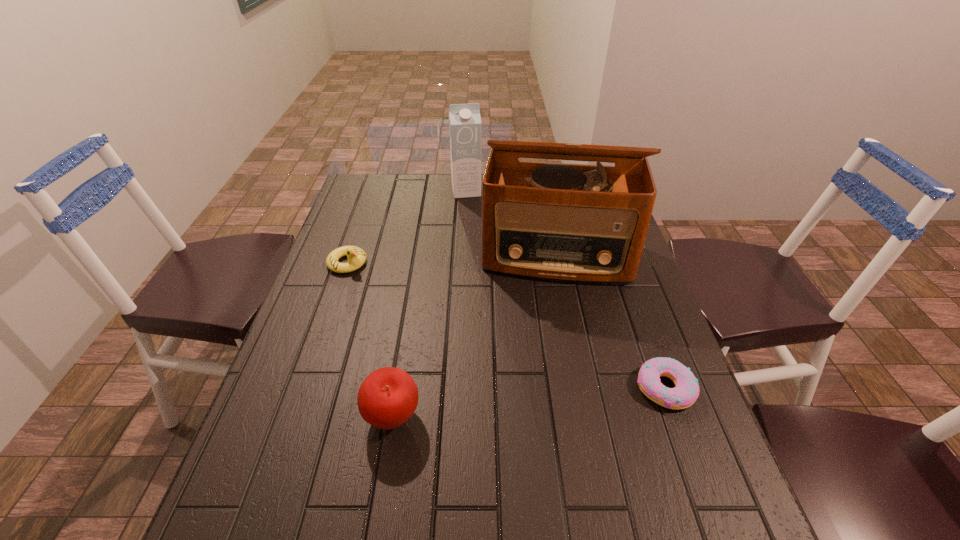
The height and width of the screenshot is (540, 960). I want to click on the second object from left to right, so click(388, 397).

The width and height of the screenshot is (960, 540). In order to click on apple in this screenshot , I will do `click(388, 397)`.

The width and height of the screenshot is (960, 540). What are the coordinates of `doughnut` in the screenshot? It's located at (686, 391).

The image size is (960, 540). Find the location of `the tallest object`. the tallest object is located at coordinates tap(580, 223).

At what (x,y) coordinates should I click in order to perform the action: click on the second shortest object. Please return your answer as a coordinate pair (x, y). The image size is (960, 540). Looking at the image, I should click on (356, 256).

This screenshot has height=540, width=960. I want to click on duckling, so click(x=356, y=256).

This screenshot has height=540, width=960. I want to click on carton, so click(464, 119).

The width and height of the screenshot is (960, 540). I want to click on the fourth shortest object, so click(464, 119).

Identify the location of vacant space positioned 0.060m on the back of the second object from left to right. The image size is (960, 540). (400, 369).

The image size is (960, 540). In order to click on free space located 0.280m on the back of the shortest object in this screenshot , I will do `click(625, 281)`.